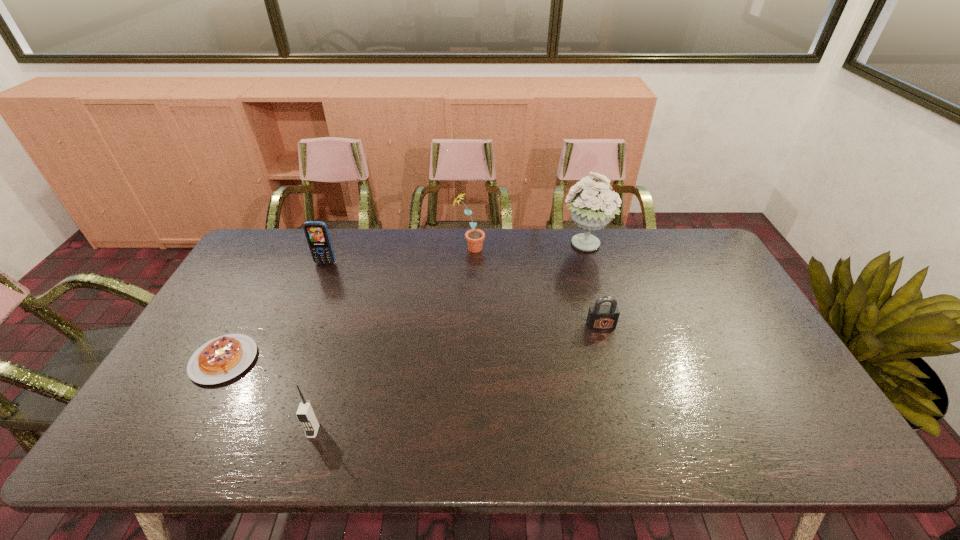
Find the location of a particular element. Image resolution: width=960 pixels, height=540 pixels. free spot between the fifth farthest object and the bouquet is located at coordinates (404, 303).

Locate an element on the screen. free point between the sunflower and the padlock is located at coordinates (535, 287).

Identify the location of vacant space that's between the fourth farthest object and the fifth shortest object. Image resolution: width=960 pixels, height=540 pixels. (535, 287).

Where is `free space between the bouquet and the second object from left to right`? The image size is (960, 540). free space between the bouquet and the second object from left to right is located at coordinates (455, 254).

Identify the location of vacant area between the fourth object from left to right and the fourth farthest object. (535, 287).

At what (x,y) coordinates should I click in order to perform the action: click on object that stands as the third closest to the nearer cellular telephone. Please return your answer as a coordinate pair (x, y). Looking at the image, I should click on (474, 237).

Identify which object is located as the third nearest to the nearest object. Please provide its 2D coordinates. Your answer should be formatted as a tuple, i.e. [(x, y)], where the tuple contains the x and y coordinates of a point satisfying the conditions above.

[(474, 237)]

Locate an element on the screen. The height and width of the screenshot is (540, 960). free space that satisfies the following two spatial constraints: 1. on the flower of the fifth shortest object; 2. on the screen of the second object from left to right is located at coordinates point(469,263).